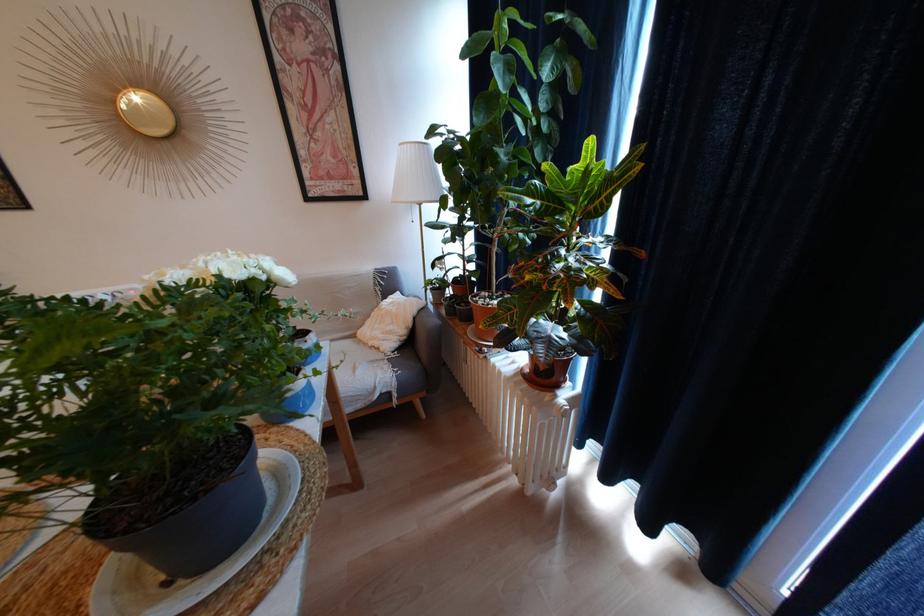
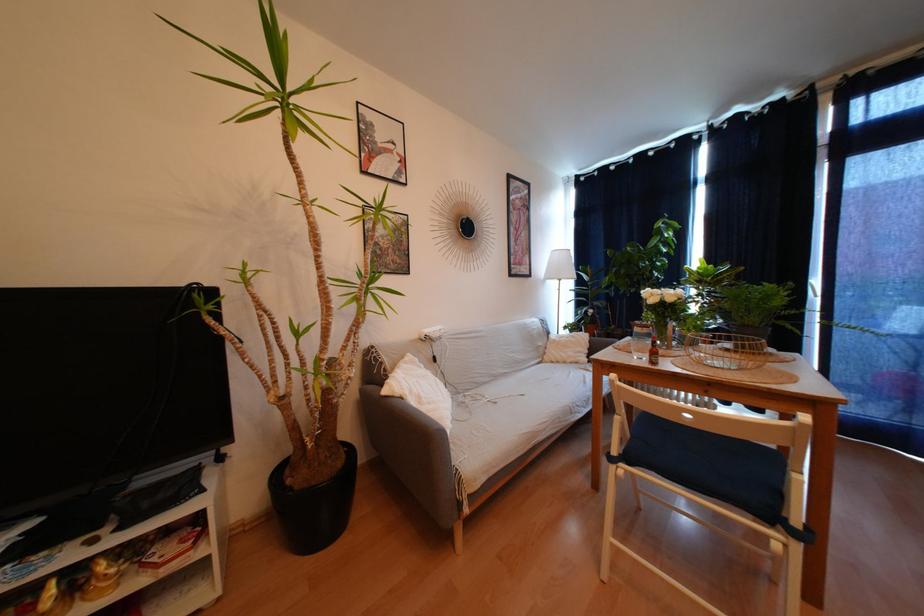
Question: In a continuous first-person perspective shot, in which direction is the camera moving?

Choices:
 (A) Left
 (B) Right
 (C) Forward
 (D) Backward

Answer: (A)